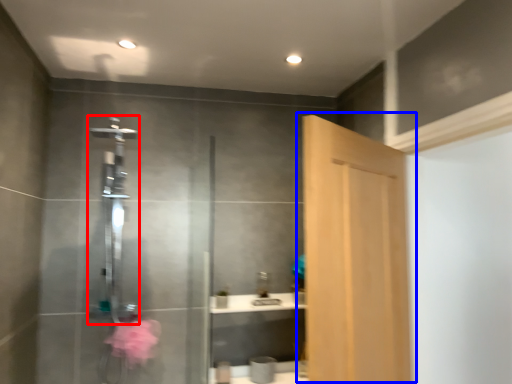
Question: Which point is closer to the camera, shower (highlighted by a red box) or door (highlighted by a blue box)?

Choices:
 (A) shower
 (B) door

Answer: (B)